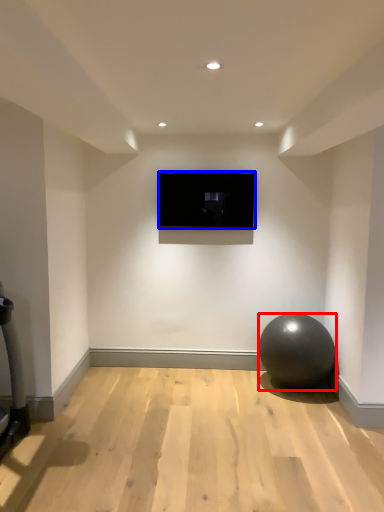
Question: Which of the following is the farthest to the observer, ball (highlighted by a red box) or television (highlighted by a blue box)?

Choices:
 (A) ball
 (B) television

Answer: (B)